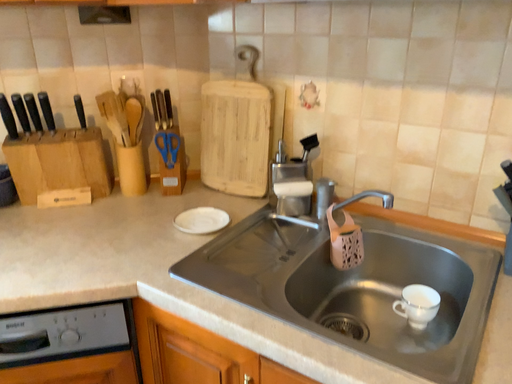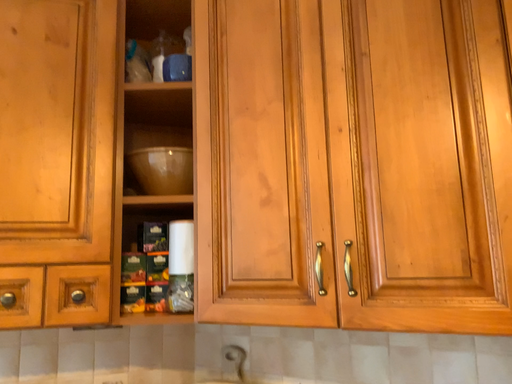
Question: How did the camera likely rotate when shooting the video?

Choices:
 (A) rotated upward
 (B) rotated downward

Answer: (A)